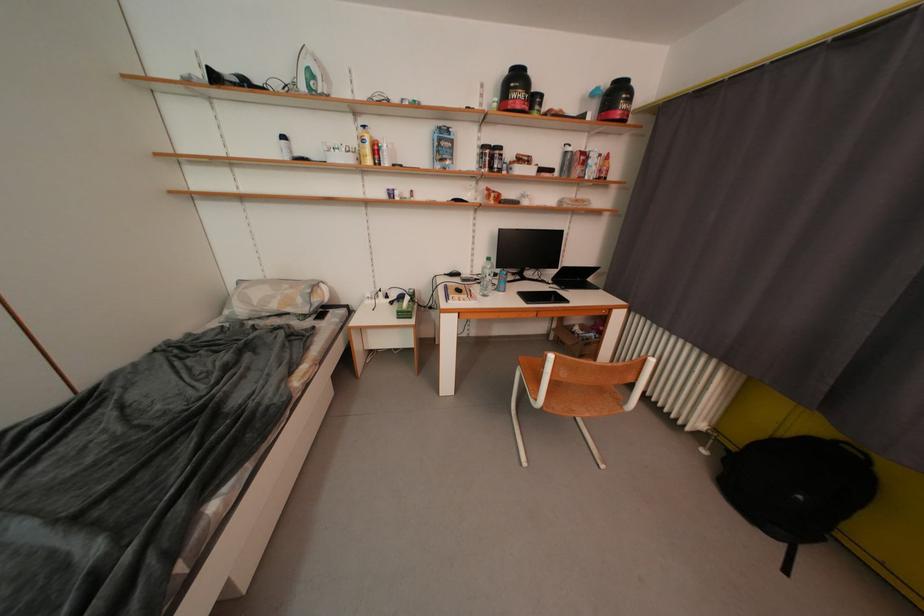
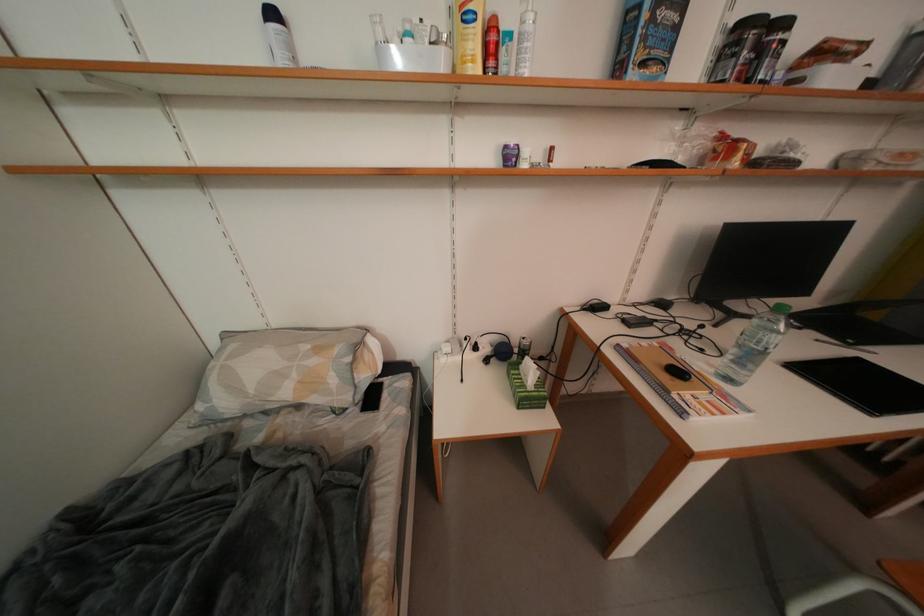
The images are taken continuously from a first-person perspective. In which direction are you moving?

The cameraman walked toward left, forward.